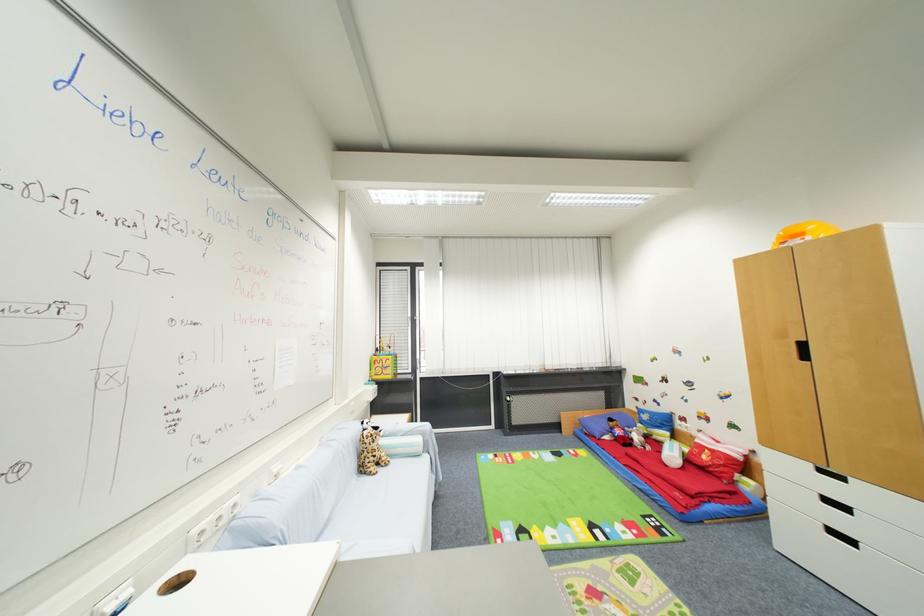
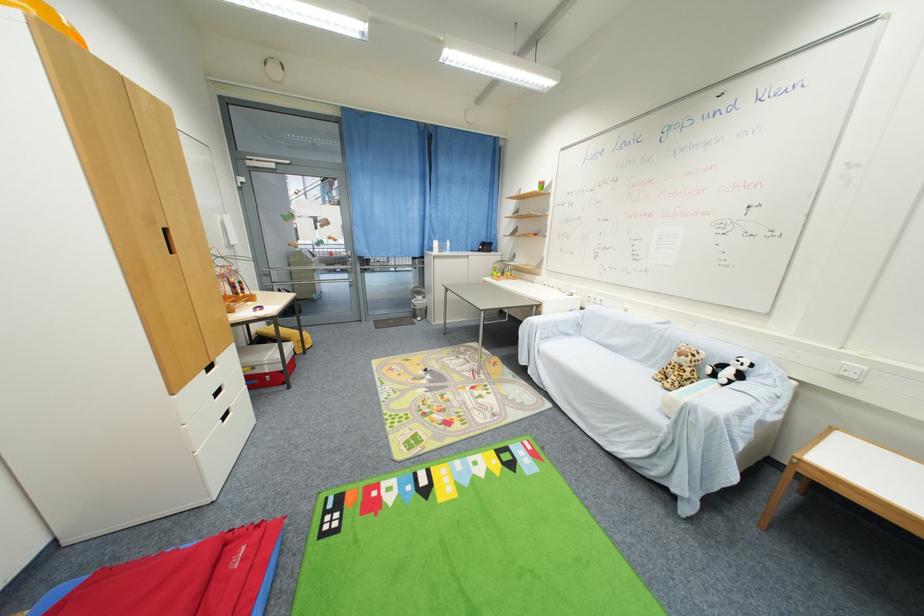
Find the pixel in the second image that matches (388,461) in the first image.

(675, 382)